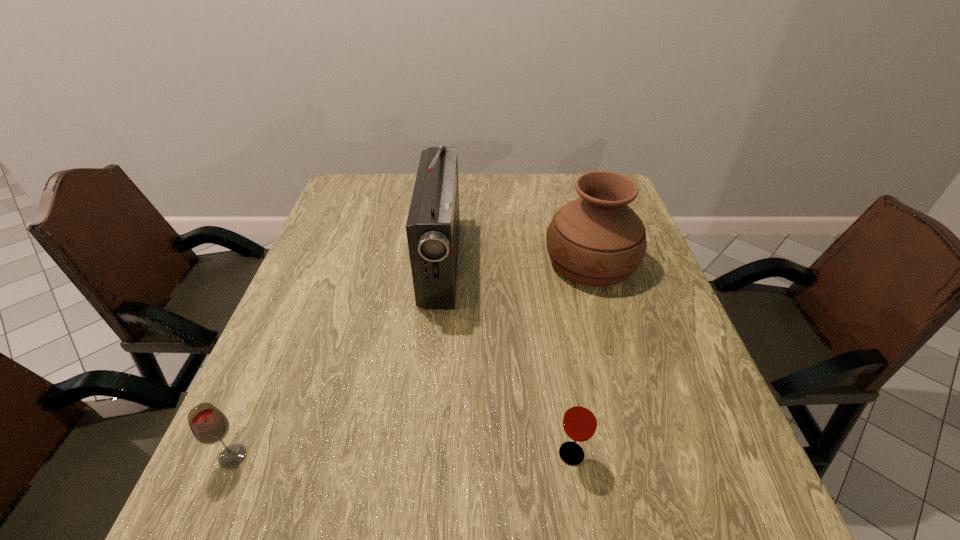
Locate an element on the screen. free region that satisfies the following two spatial constraints: 1. on the back side of the left glass drink container; 2. on the right side of the right glass drink container is located at coordinates (234, 454).

Where is `free space that satisfies the following two spatial constraints: 1. on the front-facing side of the third object from right to left; 2. on the front side of the left glass drink container`? The width and height of the screenshot is (960, 540). free space that satisfies the following two spatial constraints: 1. on the front-facing side of the third object from right to left; 2. on the front side of the left glass drink container is located at coordinates (421, 456).

Where is `vacant region that satisfies the following two spatial constraints: 1. on the front-facing side of the tallest object; 2. on the right side of the right glass drink container`? This screenshot has width=960, height=540. vacant region that satisfies the following two spatial constraints: 1. on the front-facing side of the tallest object; 2. on the right side of the right glass drink container is located at coordinates [x=421, y=454].

Locate an element on the screen. This screenshot has height=540, width=960. free spot that satisfies the following two spatial constraints: 1. on the front-facing side of the radio receiver; 2. on the right side of the right glass drink container is located at coordinates (421, 454).

The image size is (960, 540). Find the location of `vacant space that satisfies the following two spatial constraints: 1. on the front-facing side of the second object from left to right; 2. on the left side of the right glass drink container`. vacant space that satisfies the following two spatial constraints: 1. on the front-facing side of the second object from left to right; 2. on the left side of the right glass drink container is located at coordinates (421, 454).